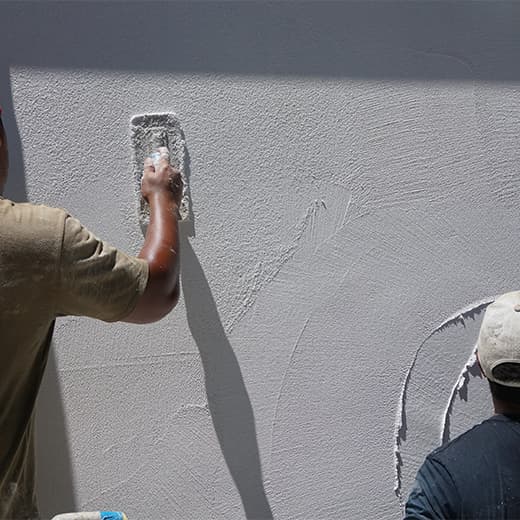
At what (x,y) coordinates should I click in order to perform the action: click on paint smears. Please return your answer as a coordinate pair (x, y). Looking at the image, I should click on (280, 281), (436, 372).